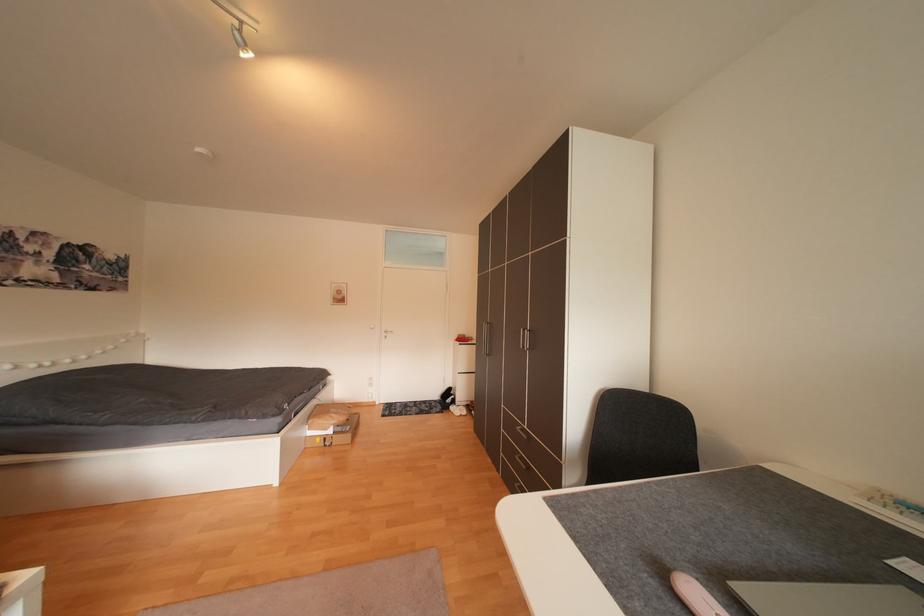
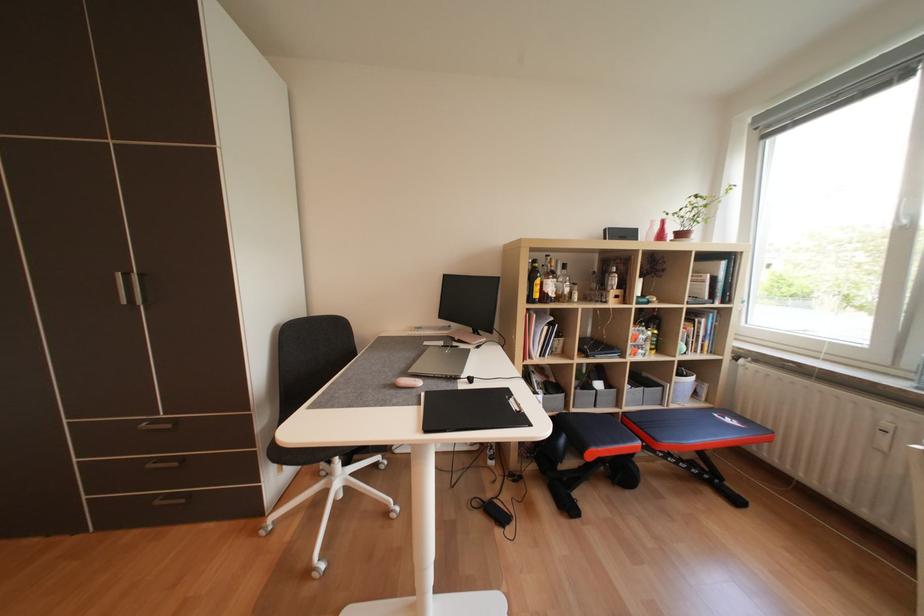
Question: The images are taken continuously from a first-person perspective. In which direction is your viewpoint rotating?

Choices:
 (A) Left
 (B) Right
 (C) Up
 (D) Down

Answer: (B)